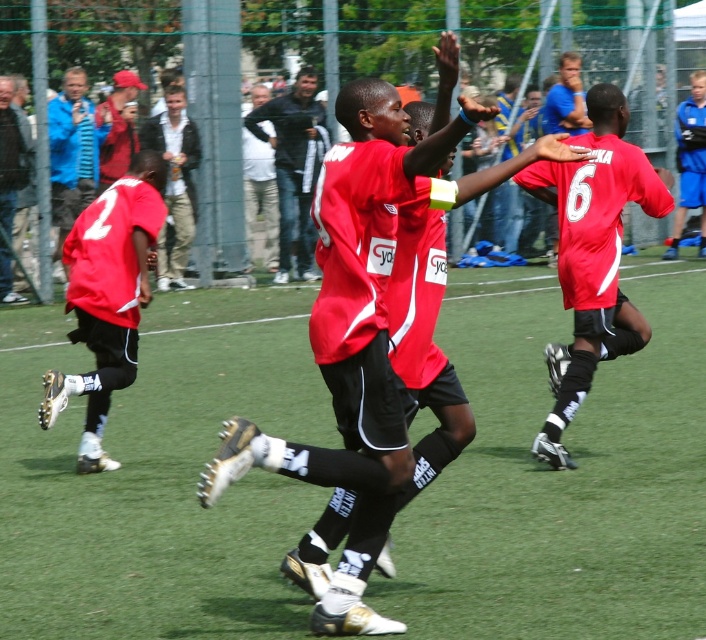
Is matte red jersey at center behind matte red jersey at left?

No, it is in front of matte red jersey at left.

Find the location of a particular element. This screenshot has width=706, height=640. matte red jersey at center is located at coordinates (592, 252).